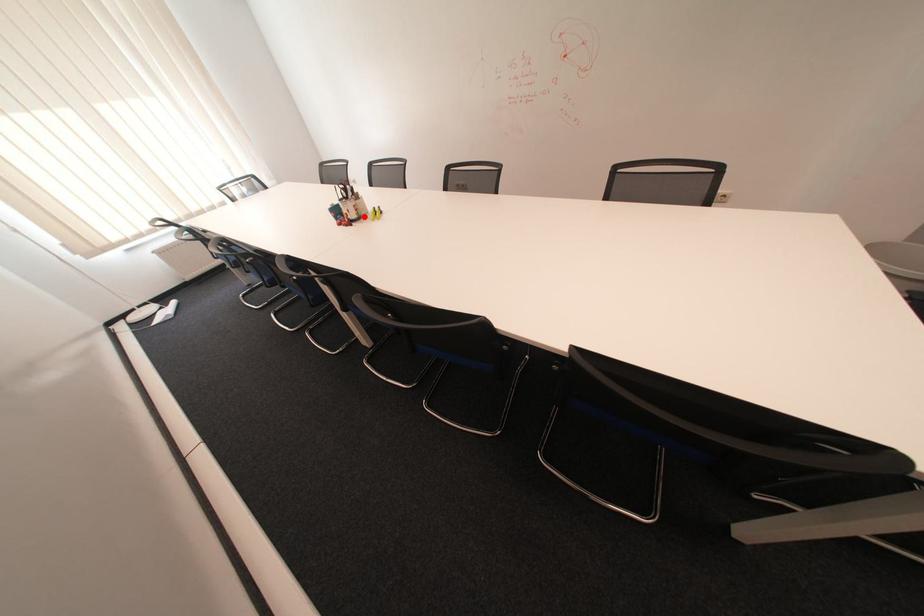
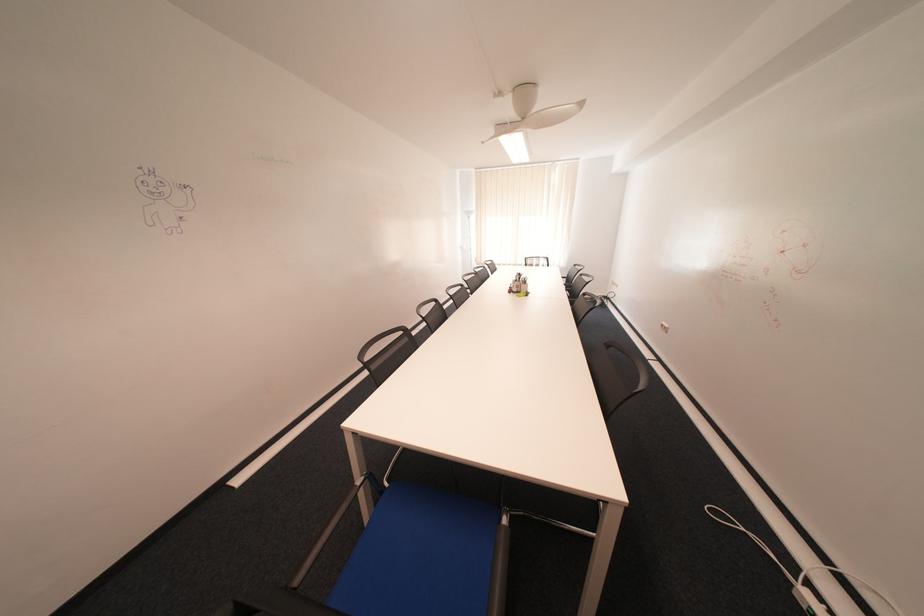
Find the pixel in the second image that matches the highlighted location in the first image.

(526, 290)